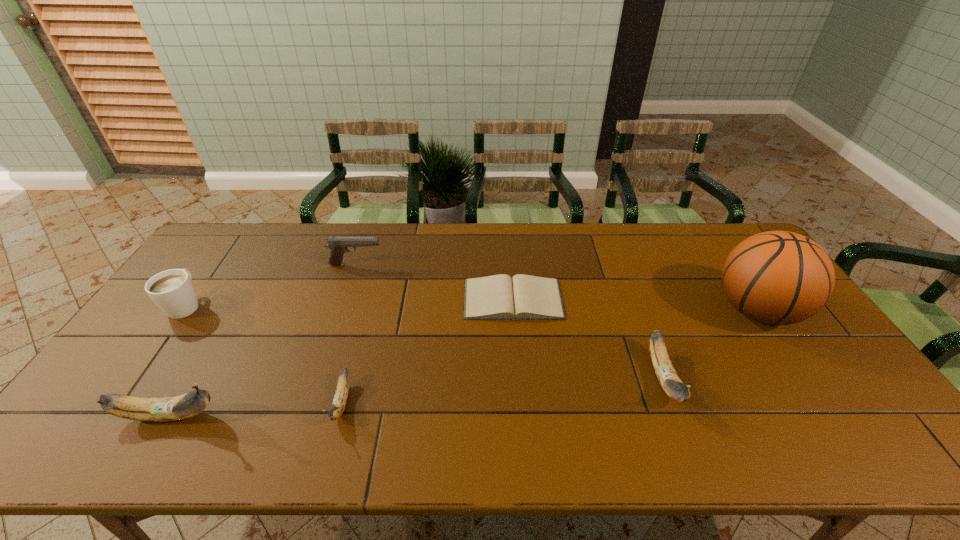
Where is `cappuccino that is at the left edge`? cappuccino that is at the left edge is located at coordinates (172, 291).

What are the coordinates of `object present at the right edge` in the screenshot? It's located at (776, 277).

Identify the location of object that is positioned at the near left corner. (160, 409).

Find the location of `blank space at the far edge of the desktop`. blank space at the far edge of the desktop is located at coordinates (297, 223).

You are a GUI agent. You are given a task and a screenshot of the screen. Output one action in this format:
    pyautogui.click(x=<x>, y=<y>)
    Task: Click on the free space at the near edge of the desktop
    
    Given the screenshot: What is the action you would take?
    pyautogui.click(x=594, y=399)

Find the location of `vacant space at the left edge`. vacant space at the left edge is located at coordinates [164, 331].

At what (x,y) coordinates should I click in order to perform the action: click on blank space at the right edge. Please return your answer as a coordinate pair (x, y). Image resolution: width=960 pixels, height=540 pixels. Looking at the image, I should click on (814, 383).

In the image, there is a desktop. Where is `vacant space at the far left corner`? vacant space at the far left corner is located at coordinates (261, 226).

The image size is (960, 540). In order to click on empty location between the tallest object and the shortest object in this screenshot , I will do `click(636, 305)`.

Identify the location of free space between the leftmost banana and the fifth object from left to right. The height and width of the screenshot is (540, 960). (341, 357).